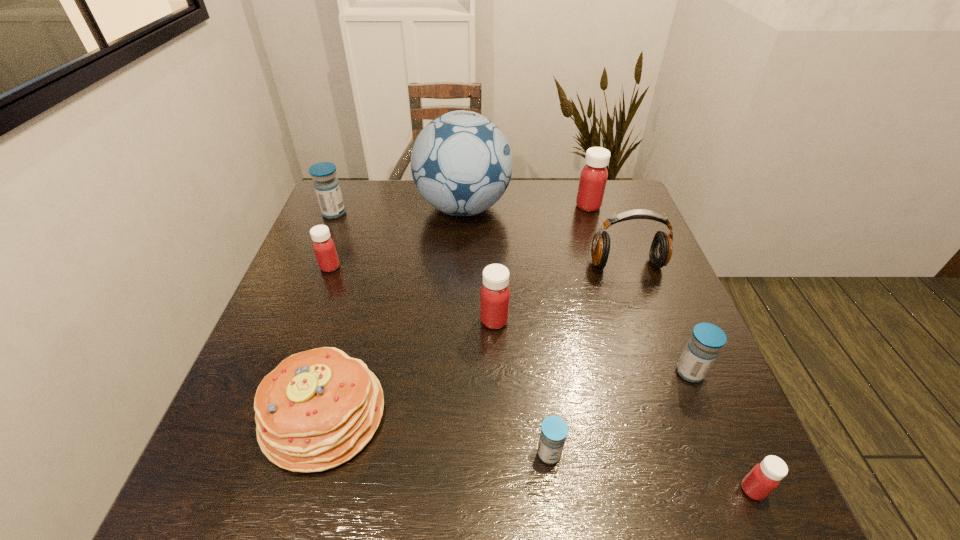
The image size is (960, 540). In order to click on blue soccer ball in this screenshot , I will do `click(461, 162)`.

Where is `soccer ball`? soccer ball is located at coordinates (461, 162).

The height and width of the screenshot is (540, 960). Find the location of `the tallest medicine`. the tallest medicine is located at coordinates (593, 178).

Identify the location of the second red medicine from right to left. This screenshot has height=540, width=960. (593, 178).

This screenshot has width=960, height=540. Find the location of `headset`. headset is located at coordinates (661, 249).

Locate an element on the screen. Image resolution: width=960 pixels, height=540 pixels. the farthest blue medicine is located at coordinates (327, 188).

Where is `the leftmost blue medicine`? Image resolution: width=960 pixels, height=540 pixels. the leftmost blue medicine is located at coordinates (327, 188).

Where is `the second biggest red medicine`? the second biggest red medicine is located at coordinates (495, 293).

Locate an element on the screen. This screenshot has width=960, height=540. the fifth medicine from right to left is located at coordinates [495, 293].

Where is `the second farthest red medicine`? This screenshot has width=960, height=540. the second farthest red medicine is located at coordinates [x=323, y=245].